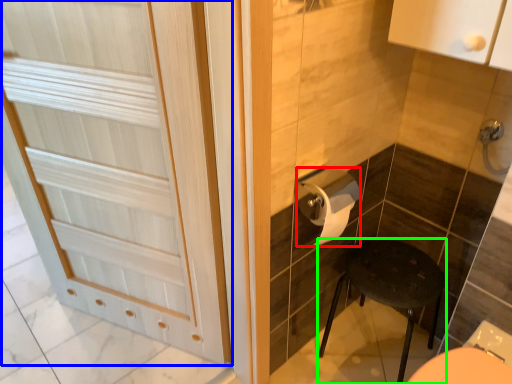
Question: Based on their relative distances, which object is farther from toilet paper (highlighted by a red box)? Choose from door (highlighted by a blue box) and furniture (highlighted by a green box).

Choices:
 (A) door
 (B) furniture

Answer: (A)